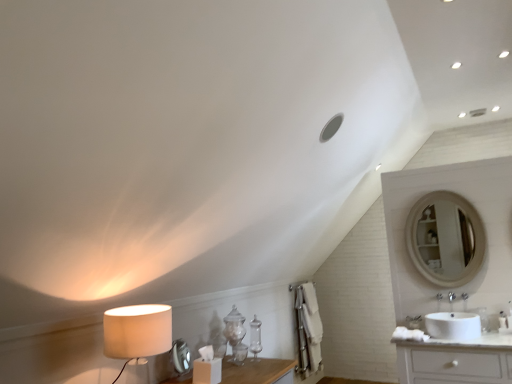
Question: Is the depth of white glossy sink at lower right greater than that of beige fabric lampshade at left?

Choices:
 (A) yes
 (B) no

Answer: (A)

Question: Is white glossy sink at lower right to the right of beige fabric lampshade at left from the viewer's perspective?

Choices:
 (A) yes
 (B) no

Answer: (A)

Question: Can you confirm if white glossy sink at lower right is thinner than beige fabric lampshade at left?

Choices:
 (A) yes
 (B) no

Answer: (B)

Question: From a real-world perspective, is white glossy sink at lower right on top of beige fabric lampshade at left?

Choices:
 (A) yes
 (B) no

Answer: (B)

Question: Is white glossy sink at lower right positioned in front of beige fabric lampshade at left?

Choices:
 (A) no
 (B) yes

Answer: (A)

Question: Does white glossy sink at lower right turn towards beige fabric lampshade at left?

Choices:
 (A) yes
 (B) no

Answer: (B)

Question: Is beige fabric lampshade at left to the left of white glossy sink at lower right from the viewer's perspective?

Choices:
 (A) yes
 (B) no

Answer: (A)

Question: Is beige fabric lampshade at left positioned far away from white glossy sink at lower right?

Choices:
 (A) no
 (B) yes

Answer: (B)

Question: Is beige fabric lampshade at left oriented towards white glossy sink at lower right?

Choices:
 (A) yes
 (B) no

Answer: (B)

Question: From the image's perspective, is beige fabric lampshade at left above white glossy sink at lower right?

Choices:
 (A) yes
 (B) no

Answer: (A)

Question: Can you see beige fabric lampshade at left touching white glossy sink at lower right?

Choices:
 (A) yes
 (B) no

Answer: (B)

Question: Is beige fabric lampshade at left positioned before white glossy sink at lower right?

Choices:
 (A) yes
 (B) no

Answer: (A)

Question: In terms of size, does white glossy sink at lower right appear bigger or smaller than beige fabric lampshade at left?

Choices:
 (A) big
 (B) small

Answer: (B)